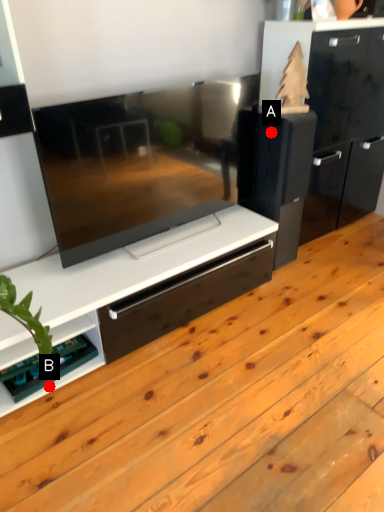
Question: Two points are circled on the image, labeled by A and B beside each circle. Which point is farther from the camera taking this photo?

Choices:
 (A) A is further
 (B) B is further

Answer: (A)